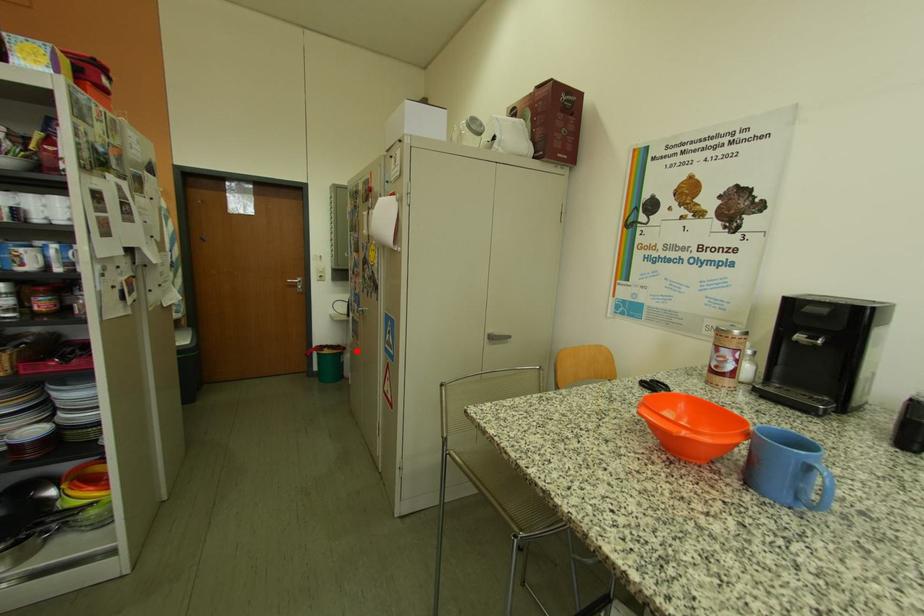
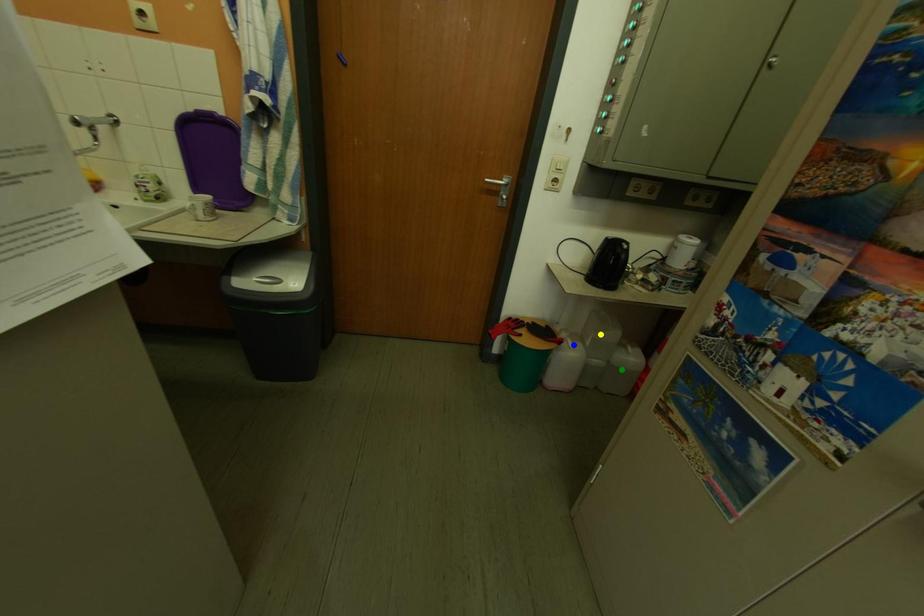
Question: I am providing you with two images of the same scene from different viewpoints. A red point is marked on the first image. You are given multiple points on the second image. Which spot in image 2 lines up with the point in image 1?

Choices:
 (A) yellow point
 (B) green point
 (C) blue point

Answer: (C)